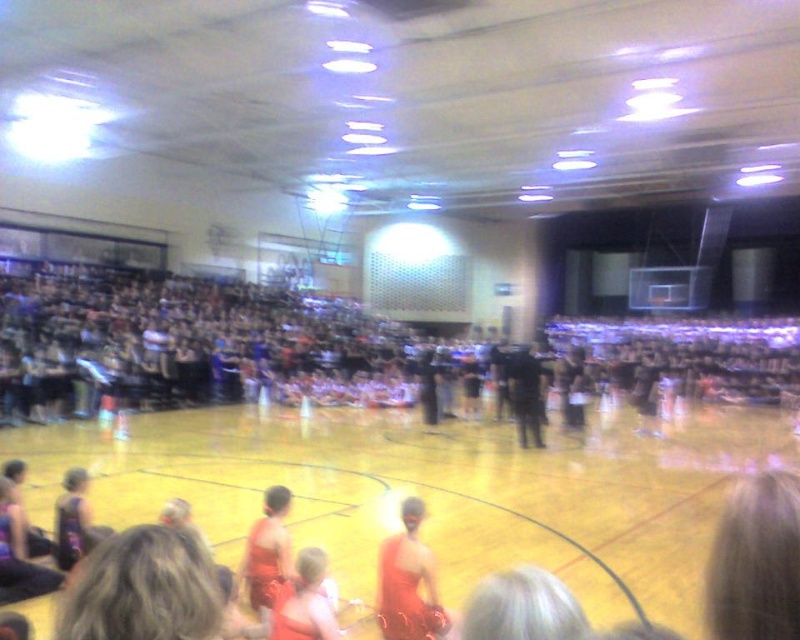
Who is positioned more to the right, dark gray fabric crowd at upper left or black matte uniform at center?

Positioned to the right is black matte uniform at center.

Who is lower down, dark gray fabric crowd at upper left or black matte uniform at center?

Positioned lower is black matte uniform at center.

Is point (106, 349) closer to camera compared to point (532, 419)?

No, it is not.

Identify the location of dark gray fabric crowd at upper left. Image resolution: width=800 pixels, height=640 pixels. (180, 342).

Who is positioned more to the right, matte red shorts at center or black matte uniform at center?

Positioned to the right is black matte uniform at center.

Does point (244, 566) come in front of point (528, 387)?

Yes, point (244, 566) is in front of point (528, 387).

Locate an element on the screen. Image resolution: width=800 pixels, height=640 pixels. matte red shorts at center is located at coordinates (268, 552).

Is dark gray fabric crowd at upper left further to the viewer compared to shiny red dress at center?

That is True.

Between dark gray fabric crowd at upper left and shiny red dress at center, which one appears on the left side from the viewer's perspective?

shiny red dress at center

Which is in front, point (56, 310) or point (417, 611)?

Positioned in front is point (417, 611).

Find the location of a particular element. The height and width of the screenshot is (640, 800). dark gray fabric crowd at upper left is located at coordinates (180, 342).